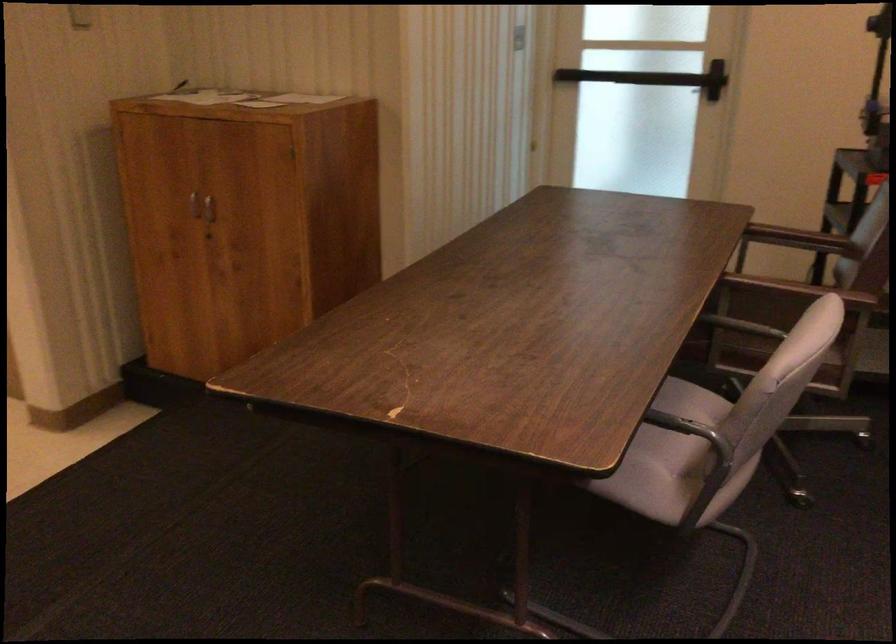
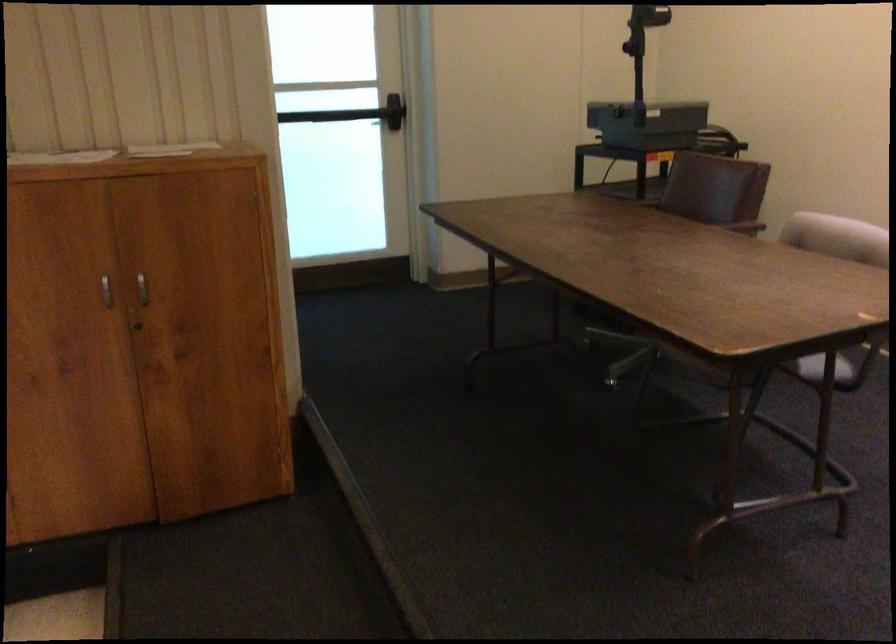
The point at (184, 202) is marked in the first image. Where is the corresponding point in the second image?

(106, 290)